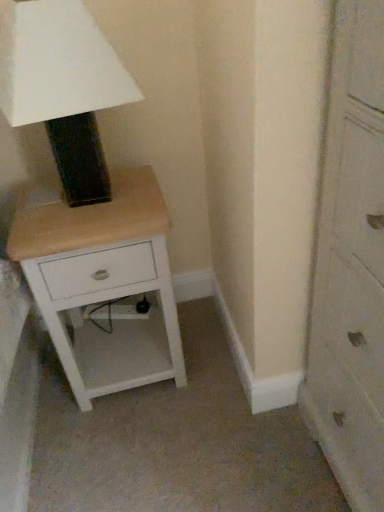
Question: Does matte black lampshade at upper left contain wooden chest of drawers at right?

Choices:
 (A) yes
 (B) no

Answer: (B)

Question: From a real-world perspective, is matte black lampshade at upper left on wooden chest of drawers at right?

Choices:
 (A) no
 (B) yes

Answer: (B)

Question: From the image's perspective, is matte black lampshade at upper left under wooden chest of drawers at right?

Choices:
 (A) no
 (B) yes

Answer: (A)

Question: Is matte black lampshade at upper left positioned far away from wooden chest of drawers at right?

Choices:
 (A) yes
 (B) no

Answer: (B)

Question: Can you confirm if matte black lampshade at upper left is wider than wooden chest of drawers at right?

Choices:
 (A) no
 (B) yes

Answer: (A)

Question: Is matte black lampshade at upper left aimed at wooden chest of drawers at right?

Choices:
 (A) no
 (B) yes

Answer: (A)

Question: Is wooden chest of drawers at right bigger than white wood nightstand at lower left?

Choices:
 (A) yes
 (B) no

Answer: (A)

Question: Is white wood nightstand at lower left a part of wooden chest of drawers at right?

Choices:
 (A) no
 (B) yes

Answer: (A)

Question: Considering the relative positions of wooden chest of drawers at right and white wood nightstand at lower left in the image provided, is wooden chest of drawers at right to the right of white wood nightstand at lower left from the viewer's perspective?

Choices:
 (A) no
 (B) yes

Answer: (B)

Question: Considering the relative sizes of wooden chest of drawers at right and white wood nightstand at lower left in the image provided, is wooden chest of drawers at right wider than white wood nightstand at lower left?

Choices:
 (A) yes
 (B) no

Answer: (B)

Question: Is the position of wooden chest of drawers at right more distant than that of white wood nightstand at lower left?

Choices:
 (A) no
 (B) yes

Answer: (A)

Question: Is wooden chest of drawers at right positioned before white wood nightstand at lower left?

Choices:
 (A) no
 (B) yes

Answer: (B)

Question: Considering the relative sizes of white wood nightstand at lower left and wooden chest of drawers at right in the image provided, is white wood nightstand at lower left bigger than wooden chest of drawers at right?

Choices:
 (A) no
 (B) yes

Answer: (A)